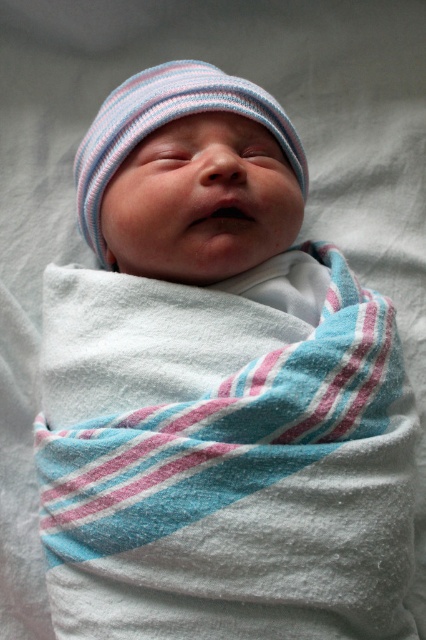
Is white soft blanket at center closer to camera compared to striped knit hat at center?

Yes.

Is point (81, 561) in front of point (250, 92)?

Yes.

Identify the location of white soft blanket at center. (224, 461).